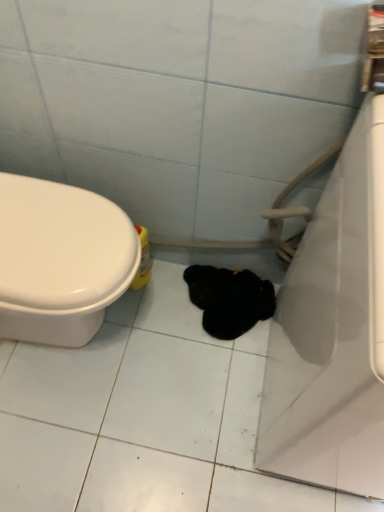
Locate an element on the screen. The height and width of the screenshot is (512, 384). free location in front of yellow plastic bottle at lower left is located at coordinates (142, 323).